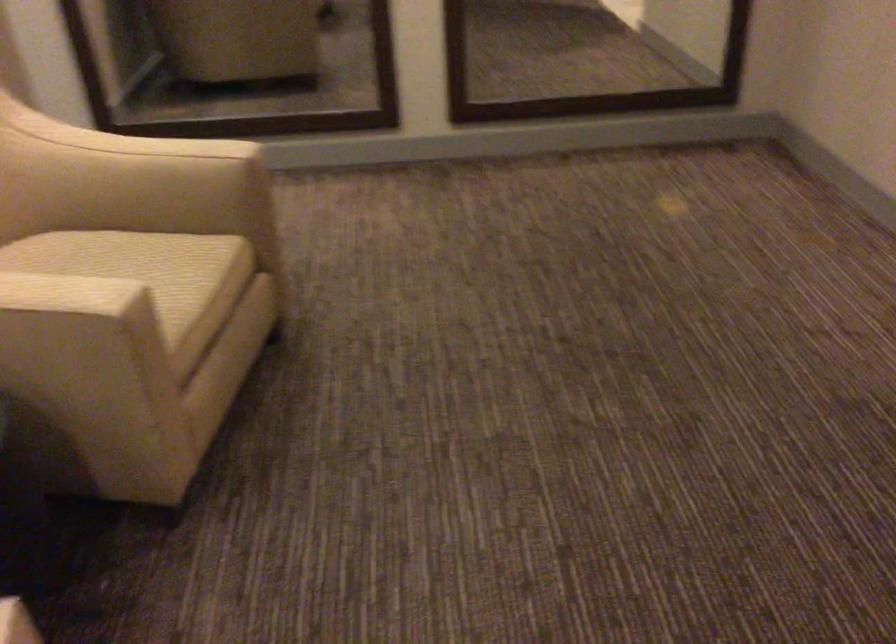
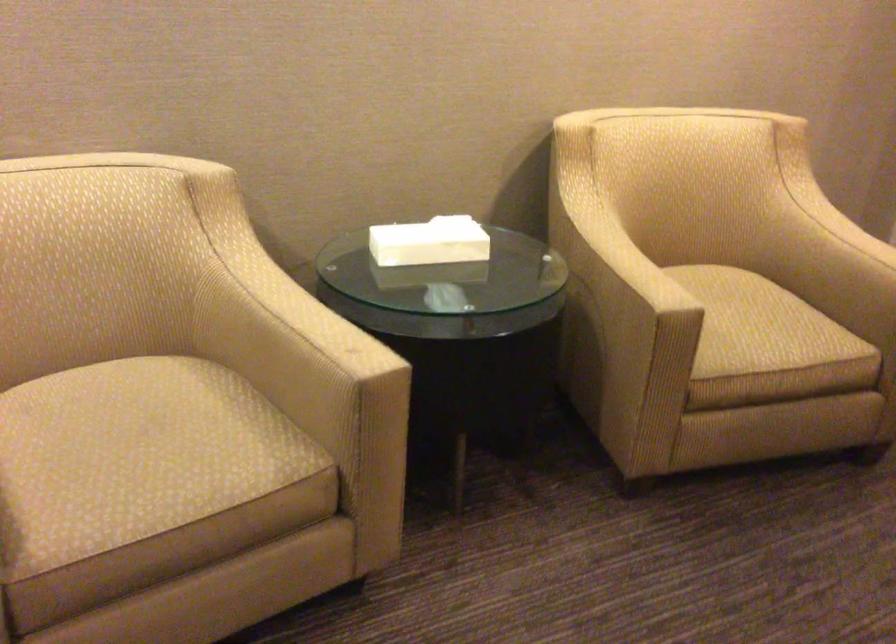
Question: How did the camera likely rotate?

Choices:
 (A) Left
 (B) Right
 (C) Up
 (D) Down

Answer: (A)